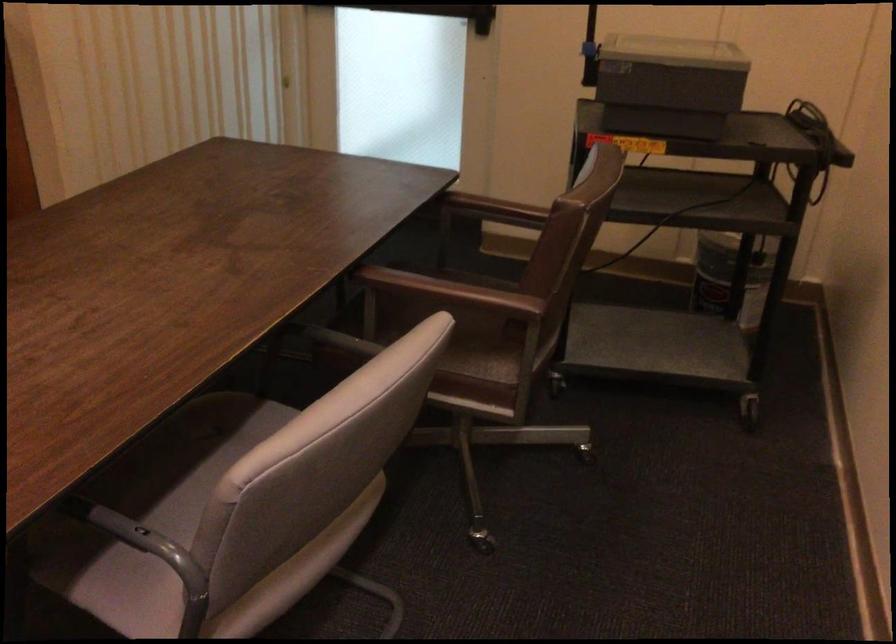
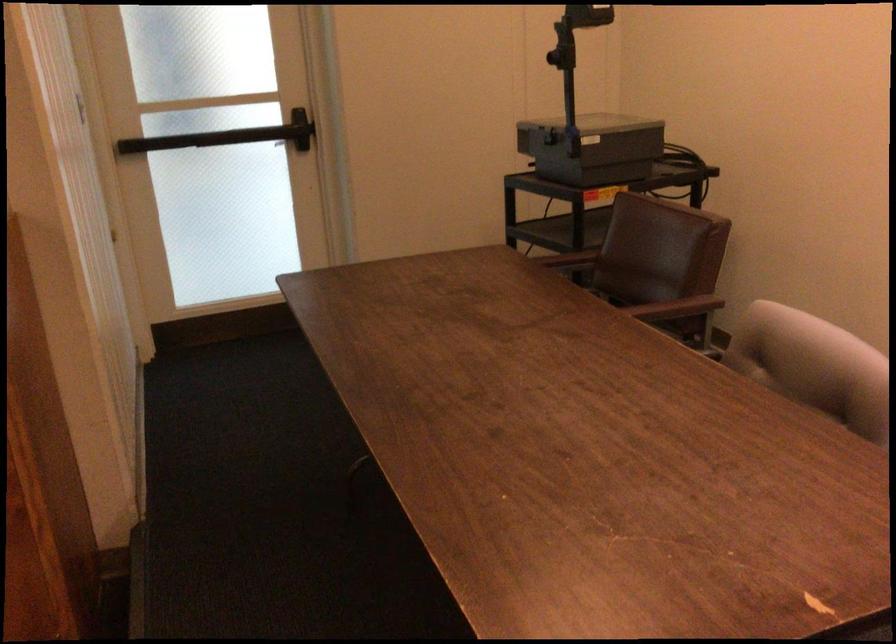
Question: I am providing you with two images of the same scene from different viewpoints. Please identify which objects are invisible in image2.

Choices:
 (A) brown chair armrest
 (B) gray sofa sitting surface
 (C) grey chair sitting surface
 (D) overhead projector

Answer: (C)